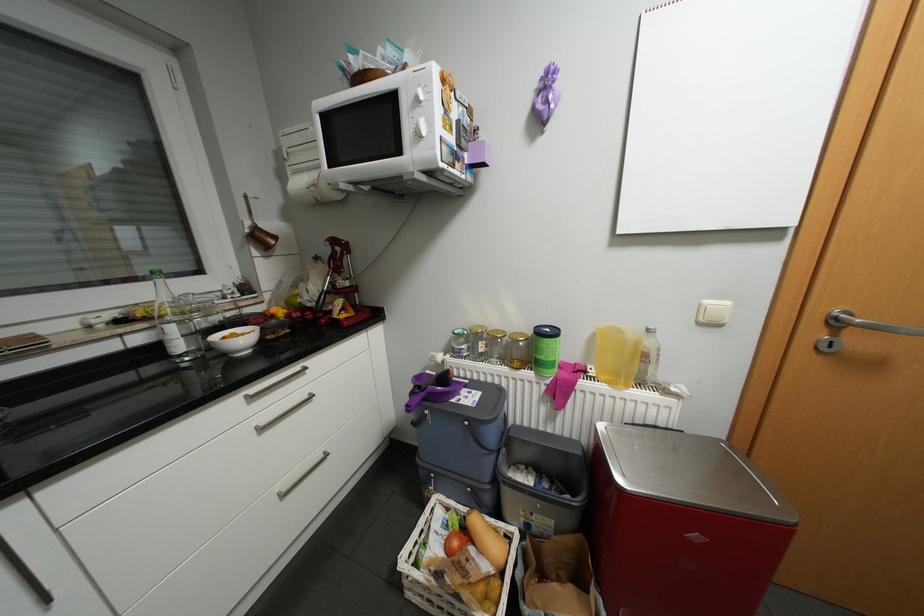
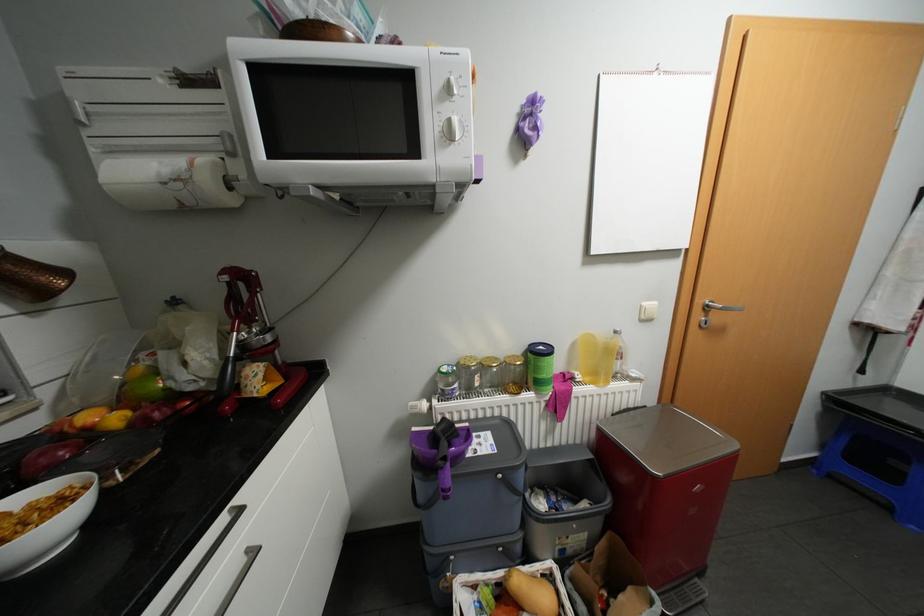
Where in the second image is the point corresponding to (641,424) from the first image?

(626, 411)